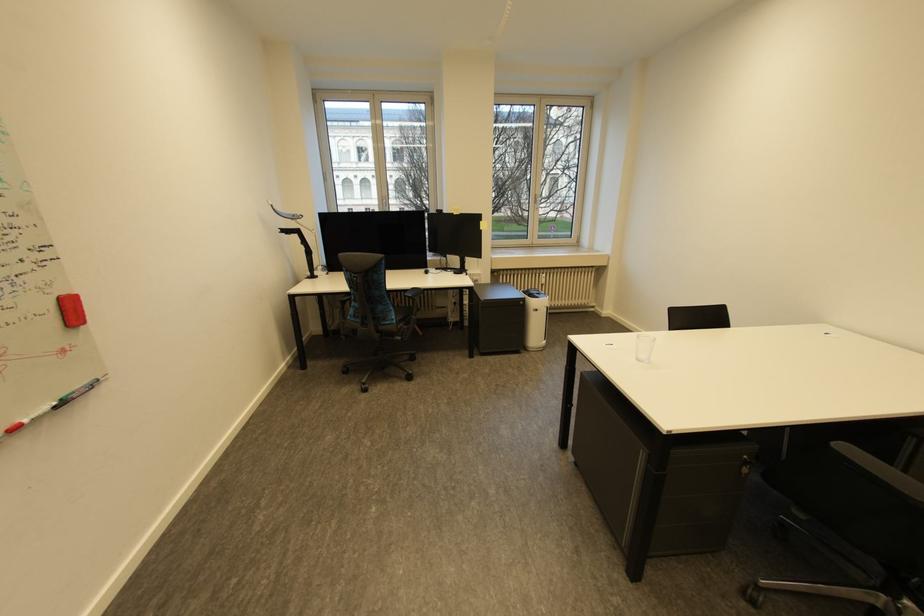
Locate an element on the screen. The width and height of the screenshot is (924, 616). chair armrest is located at coordinates (835, 594).